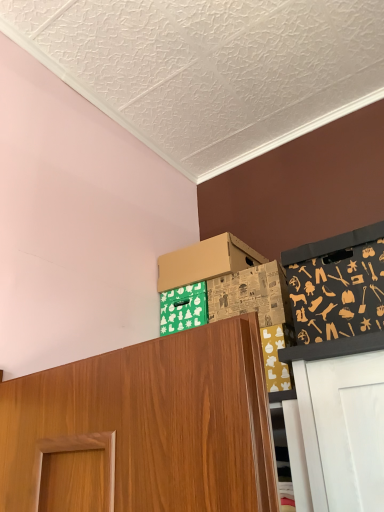
Question: Which direction should I rotate to look at cardboard box at upper center, the first box when ordered from front to back, — up or down?

Choices:
 (A) down
 (B) up

Answer: (A)

Question: Could black fabric with tool patterns at upper right be considered to be inside brown cardboard box at upper center, which ranks as the 2th box in front-to-back order?

Choices:
 (A) no
 (B) yes

Answer: (A)

Question: Is brown cardboard box at upper center, arranged as the 1th box when viewed from the back, completely or partially outside of black fabric with tool patterns at upper right?

Choices:
 (A) yes
 (B) no

Answer: (A)

Question: Considering the relative sizes of brown cardboard box at upper center, which ranks as the 2th box in front-to-back order, and black fabric with tool patterns at upper right in the image provided, is brown cardboard box at upper center, which ranks as the 2th box in front-to-back order, bigger than black fabric with tool patterns at upper right?

Choices:
 (A) no
 (B) yes

Answer: (A)

Question: Is brown cardboard box at upper center, which ranks as the 2th box in front-to-back order, wider than black fabric with tool patterns at upper right?

Choices:
 (A) no
 (B) yes

Answer: (A)

Question: Is black fabric with tool patterns at upper right at the back of brown cardboard box at upper center, arranged as the 1th box when viewed from the back?

Choices:
 (A) no
 (B) yes

Answer: (A)

Question: From a real-world perspective, is brown cardboard box at upper center, which ranks as the 2th box in front-to-back order, over black fabric with tool patterns at upper right?

Choices:
 (A) no
 (B) yes

Answer: (B)

Question: Is black fabric with tool patterns at upper right oriented away from cardboard box at upper center, the first box when ordered from front to back?

Choices:
 (A) no
 (B) yes

Answer: (A)

Question: Does black fabric with tool patterns at upper right have a smaller size compared to cardboard box at upper center, the first box when ordered from front to back?

Choices:
 (A) no
 (B) yes

Answer: (A)

Question: Does black fabric with tool patterns at upper right touch cardboard box at upper center, the first box when ordered from front to back?

Choices:
 (A) no
 (B) yes

Answer: (A)

Question: Are black fabric with tool patterns at upper right and cardboard box at upper center, which is counted as the second box, starting from the back, located far from each other?

Choices:
 (A) no
 (B) yes

Answer: (A)

Question: From the image's perspective, is black fabric with tool patterns at upper right beneath cardboard box at upper center, which is counted as the second box, starting from the back?

Choices:
 (A) no
 (B) yes

Answer: (A)

Question: Does black fabric with tool patterns at upper right have a greater height compared to cardboard box at upper center, which is counted as the second box, starting from the back?

Choices:
 (A) no
 (B) yes

Answer: (B)

Question: Is cardboard box at upper center, the first box when ordered from front to back, smaller than brown cardboard box at upper center, arranged as the 1th box when viewed from the back?

Choices:
 (A) yes
 (B) no

Answer: (A)